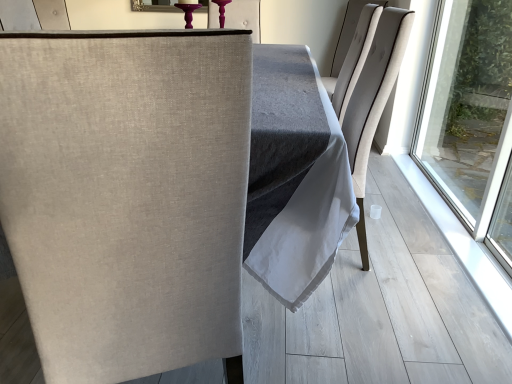
Locate an element on the screen. light beige fabric chair at upper right, the first chair positioned from the back is located at coordinates (350, 37).

What do you see at coordinates (350, 37) in the screenshot? The image size is (512, 384). I see `light beige fabric chair at upper right, the second chair in the bottom-to-top sequence` at bounding box center [350, 37].

Measure the distance between light beige fabric chair at upper right, the second chair in the bottom-to-top sequence, and camera.

light beige fabric chair at upper right, the second chair in the bottom-to-top sequence, and camera are 2.76 meters apart.

This screenshot has width=512, height=384. What are the coordinates of `beige fabric chair at left, positioned as the first chair in left-to-right order` in the screenshot? It's located at (126, 195).

This screenshot has height=384, width=512. Describe the element at coordinates (126, 195) in the screenshot. I see `beige fabric chair at left, which is the 1th chair from front to back` at that location.

This screenshot has width=512, height=384. In order to click on light beige fabric chair at upper right, placed as the second chair when sorted from front to back in this screenshot , I will do `click(350, 37)`.

Which is more to the right, beige fabric chair at left, the second chair viewed from the top, or light beige fabric chair at upper right, the second chair in the bottom-to-top sequence?

Positioned to the right is light beige fabric chair at upper right, the second chair in the bottom-to-top sequence.

Is beige fabric chair at left, positioned as the first chair in left-to-right order, in front of or behind light beige fabric chair at upper right, the first chair positioned from the back, in the image?

Visually, beige fabric chair at left, positioned as the first chair in left-to-right order, is located in front of light beige fabric chair at upper right, the first chair positioned from the back.

Is point (194, 101) closer to camera compared to point (354, 13)?

Yes, point (194, 101) is closer to viewer.

From the image's perspective, which one is positioned lower, beige fabric chair at left, positioned as the 2th chair in right-to-left order, or light beige fabric chair at upper right, acting as the first chair starting from the right?

beige fabric chair at left, positioned as the 2th chair in right-to-left order.

From a real-world perspective, between beige fabric chair at left, which is the 1th chair from front to back, and light beige fabric chair at upper right, placed as the second chair when sorted from front to back, who is vertically higher?

light beige fabric chair at upper right, placed as the second chair when sorted from front to back, from a real-world perspective.

Can you confirm if beige fabric chair at left, acting as the second chair starting from the back, is wider than light beige fabric chair at upper right, which ranks as the second chair in left-to-right order?

Indeed, beige fabric chair at left, acting as the second chair starting from the back, has a greater width compared to light beige fabric chair at upper right, which ranks as the second chair in left-to-right order.

Is beige fabric chair at left, which is the 1th chair from front to back, taller than light beige fabric chair at upper right, placed as the second chair when sorted from front to back?

Correct, beige fabric chair at left, which is the 1th chair from front to back, is much taller as light beige fabric chair at upper right, placed as the second chair when sorted from front to back.

Who is bigger, beige fabric chair at left, acting as the second chair starting from the back, or light beige fabric chair at upper right, the first chair positioned from the back?

beige fabric chair at left, acting as the second chair starting from the back, is bigger.

Is beige fabric chair at left, the second chair viewed from the top, not within light beige fabric chair at upper right, which appears as the first chair when viewed from the top?

Yes, beige fabric chair at left, the second chair viewed from the top, is located beyond the bounds of light beige fabric chair at upper right, which appears as the first chair when viewed from the top.

Would you say beige fabric chair at left, which is the 1th chair from front to back, is a long distance from light beige fabric chair at upper right, acting as the first chair starting from the right?

That's right, there is a large distance between beige fabric chair at left, which is the 1th chair from front to back, and light beige fabric chair at upper right, acting as the first chair starting from the right.

Is beige fabric chair at left, positioned as the 2th chair in right-to-left order, turned away from light beige fabric chair at upper right, the first chair positioned from the back?

No, beige fabric chair at left, positioned as the 2th chair in right-to-left order,'s orientation is not away from light beige fabric chair at upper right, the first chair positioned from the back.

Measure the distance between beige fabric chair at left, arranged as the first chair when ordered from the bottom, and light beige fabric chair at upper right, the first chair positioned from the back.

The distance of beige fabric chair at left, arranged as the first chair when ordered from the bottom, from light beige fabric chair at upper right, the first chair positioned from the back, is 2.62 meters.

Where is `chair above the beige fabric chair at left, arranged as the first chair when ordered from the bottom (from the image's perspective)`? This screenshot has width=512, height=384. chair above the beige fabric chair at left, arranged as the first chair when ordered from the bottom (from the image's perspective) is located at coordinates (350, 37).

Based on the photo, considering the positions of objects light beige fabric chair at upper right, which appears as the first chair when viewed from the top, and beige fabric chair at left, arranged as the first chair when ordered from the bottom, in the image provided, who is more to the left, light beige fabric chair at upper right, which appears as the first chair when viewed from the top, or beige fabric chair at left, arranged as the first chair when ordered from the bottom,?

beige fabric chair at left, arranged as the first chair when ordered from the bottom.

Considering the relative positions of light beige fabric chair at upper right, the second chair in the bottom-to-top sequence, and beige fabric chair at left, acting as the second chair starting from the back, in the image provided, is light beige fabric chair at upper right, the second chair in the bottom-to-top sequence, behind beige fabric chair at left, acting as the second chair starting from the back,?

Yes, the depth of light beige fabric chair at upper right, the second chair in the bottom-to-top sequence, is greater than that of beige fabric chair at left, acting as the second chair starting from the back.

Between point (381, 8) and point (93, 318), which one is positioned behind?

The point (381, 8) is behind.

From the image's perspective, does light beige fabric chair at upper right, the first chair positioned from the back, appear lower than beige fabric chair at left, arranged as the first chair when ordered from the bottom?

No.

From a real-world perspective, which is physically above, light beige fabric chair at upper right, placed as the second chair when sorted from front to back, or beige fabric chair at left, positioned as the first chair in left-to-right order?

light beige fabric chair at upper right, placed as the second chair when sorted from front to back.

Is light beige fabric chair at upper right, acting as the first chair starting from the right, wider or thinner than beige fabric chair at left, arranged as the first chair when ordered from the bottom?

Clearly, light beige fabric chair at upper right, acting as the first chair starting from the right, has less width compared to beige fabric chair at left, arranged as the first chair when ordered from the bottom.

Is light beige fabric chair at upper right, acting as the first chair starting from the right, taller or shorter than beige fabric chair at left, acting as the second chair starting from the back?

Considering their sizes, light beige fabric chair at upper right, acting as the first chair starting from the right, has less height than beige fabric chair at left, acting as the second chair starting from the back.

Can you confirm if light beige fabric chair at upper right, the second chair in the bottom-to-top sequence, is bigger than beige fabric chair at left, positioned as the 2th chair in right-to-left order?

Incorrect, light beige fabric chair at upper right, the second chair in the bottom-to-top sequence, is not larger than beige fabric chair at left, positioned as the 2th chair in right-to-left order.

Is beige fabric chair at left, positioned as the first chair in left-to-right order, completely or partially inside light beige fabric chair at upper right, the second chair in the bottom-to-top sequence?

No, beige fabric chair at left, positioned as the first chair in left-to-right order, is not a part of light beige fabric chair at upper right, the second chair in the bottom-to-top sequence.

Is there a large distance between light beige fabric chair at upper right, the first chair positioned from the back, and beige fabric chair at left, arranged as the first chair when ordered from the bottom?

Yes, light beige fabric chair at upper right, the first chair positioned from the back, is far from beige fabric chair at left, arranged as the first chair when ordered from the bottom.

Is light beige fabric chair at upper right, acting as the first chair starting from the right, aimed at beige fabric chair at left, positioned as the first chair in left-to-right order?

No, light beige fabric chair at upper right, acting as the first chair starting from the right, is not oriented towards beige fabric chair at left, positioned as the first chair in left-to-right order.

Can you tell me how much light beige fabric chair at upper right, the second chair in the bottom-to-top sequence, and beige fabric chair at left, the second chair viewed from the top, differ in facing direction?

The facing directions of light beige fabric chair at upper right, the second chair in the bottom-to-top sequence, and beige fabric chair at left, the second chair viewed from the top, are 105 degrees apart.

How much distance is there between light beige fabric chair at upper right, which ranks as the second chair in left-to-right order, and beige fabric chair at left, acting as the second chair starting from the back?

They are 8.60 feet apart.

Find the location of a particular element. The width and height of the screenshot is (512, 384). chair below the light beige fabric chair at upper right, the second chair in the bottom-to-top sequence (from the image's perspective) is located at coordinates (126, 195).

You are a GUI agent. You are given a task and a screenshot of the screen. Output one action in this format:
    pyautogui.click(x=<x>, y=<y>)
    Task: Click on the chair that is in front of the light beige fabric chair at upper right, placed as the second chair when sorted from front to back
    This screenshot has width=512, height=384.
    Given the screenshot: What is the action you would take?
    pyautogui.click(x=126, y=195)

The height and width of the screenshot is (384, 512). Find the location of `chair below the light beige fabric chair at upper right, the first chair positioned from the back (from a real-world perspective)`. chair below the light beige fabric chair at upper right, the first chair positioned from the back (from a real-world perspective) is located at coordinates (126, 195).